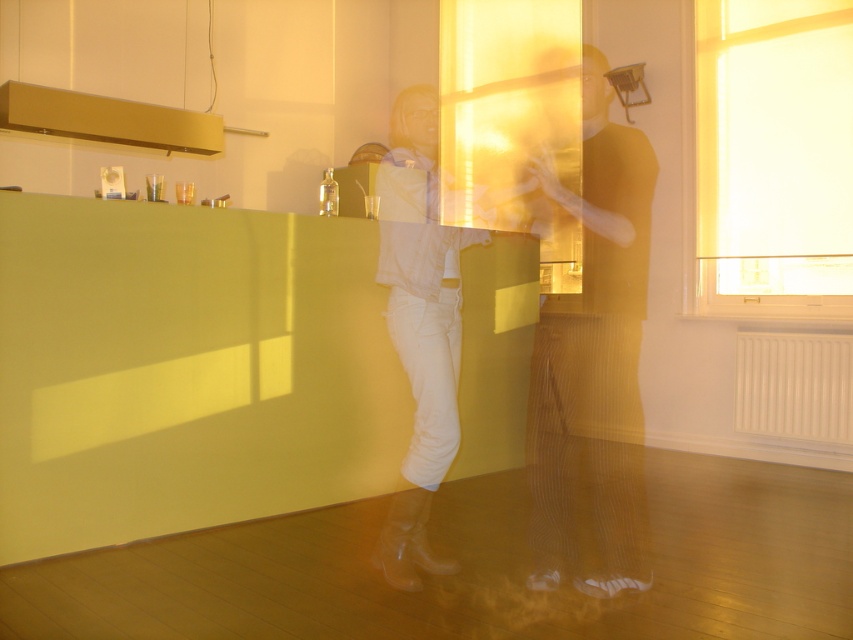
Question: Which of the following is the farthest from the observer?

Choices:
 (A) white leather boots at center
 (B) matte gold tank top at center
 (C) white fabric at right

Answer: (C)

Question: Which point appears closest to the camera in this image?

Choices:
 (A) (378, 260)
 (B) (608, 179)

Answer: (A)

Question: Based on their relative distances, which object is nearer to the matte gold tank top at center?

Choices:
 (A) white leather boots at center
 (B) white fabric at right

Answer: (A)

Question: Does white fabric at right have a larger size compared to white leather boots at center?

Choices:
 (A) yes
 (B) no

Answer: (B)

Question: Can you confirm if white fabric at right is thinner than white leather boots at center?

Choices:
 (A) no
 (B) yes

Answer: (A)

Question: Does white fabric at right appear on the left side of matte gold tank top at center?

Choices:
 (A) no
 (B) yes

Answer: (A)